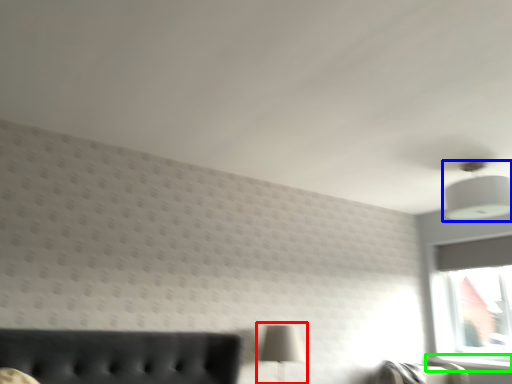
Question: Which object is the farthest from table lamp (highlighted by a red box)? Choose among these: lamp (highlighted by a blue box) or window sill (highlighted by a green box).

Choices:
 (A) lamp
 (B) window sill

Answer: (B)